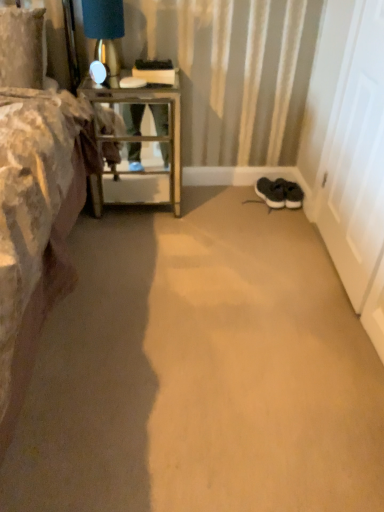
Question: Should I look upward or downward to see matte gold table lamp at upper left?

Choices:
 (A) up
 (B) down

Answer: (A)

Question: Is white matte door at right located outside black suede sneakers at lower right?

Choices:
 (A) no
 (B) yes

Answer: (B)

Question: From the image's perspective, would you say white matte door at right is shown under black suede sneakers at lower right?

Choices:
 (A) yes
 (B) no

Answer: (B)

Question: Is the depth of white matte door at right greater than that of black suede sneakers at lower right?

Choices:
 (A) yes
 (B) no

Answer: (B)

Question: Is there a large distance between white matte door at right and black suede sneakers at lower right?

Choices:
 (A) yes
 (B) no

Answer: (B)

Question: Does white matte door at right have a lesser height compared to black suede sneakers at lower right?

Choices:
 (A) no
 (B) yes

Answer: (A)

Question: Considering the relative positions of white matte door at right and black suede sneakers at lower right in the image provided, is white matte door at right to the right of black suede sneakers at lower right from the viewer's perspective?

Choices:
 (A) yes
 (B) no

Answer: (A)

Question: Is metallic glass table at left a part of white matte door at right?

Choices:
 (A) yes
 (B) no

Answer: (B)

Question: Is white matte door at right smaller than metallic glass table at left?

Choices:
 (A) no
 (B) yes

Answer: (B)

Question: Is white matte door at right positioned beyond the bounds of metallic glass table at left?

Choices:
 (A) yes
 (B) no

Answer: (A)

Question: From the image's perspective, is white matte door at right on top of metallic glass table at left?

Choices:
 (A) yes
 (B) no

Answer: (B)

Question: Can you confirm if white matte door at right is shorter than metallic glass table at left?

Choices:
 (A) yes
 (B) no

Answer: (B)

Question: Is white matte door at right positioned in front of metallic glass table at left?

Choices:
 (A) yes
 (B) no

Answer: (A)

Question: From a real-world perspective, is black suede sneakers at lower right beneath metallic glass table at left?

Choices:
 (A) yes
 (B) no

Answer: (A)